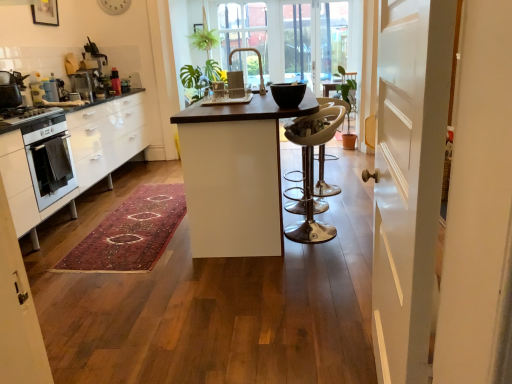
Question: Is point (98, 97) closer or farther from the camera than point (296, 100)?

Choices:
 (A) farther
 (B) closer

Answer: (A)

Question: In terms of height, does metallic silver coffee machine at upper left, which is the 1th appliance from back to front, look taller or shorter compared to black glossy bowl at center, which is the 1th appliance in bottom-to-top order?

Choices:
 (A) short
 (B) tall

Answer: (B)

Question: Estimate the real-world distances between objects in this image. Which object is farther from the white glossy stove at left?

Choices:
 (A) clear glass window at center
 (B) black glossy bowl at center, which is the fourth appliance in left-to-right order
 (C) white glossy oven at left
 (D) metallic silver coffee machine at upper left, the fourth appliance positioned from the bottom
 (E) metallic silver coffee machine at left, which is counted as the third appliance, starting from the left

Answer: (A)

Question: Based on their relative distances, which object is nearer to the white glossy table at center?

Choices:
 (A) white glossy oven at left
 (B) metallic silver coffee machine at left, which is the 1th appliance in left-to-right order
 (C) white glossy cabinets at left
 (D) metallic silver bar stool at center
 (E) metallic silver coffee machine at upper left, the fourth appliance positioned from the bottom

Answer: (D)